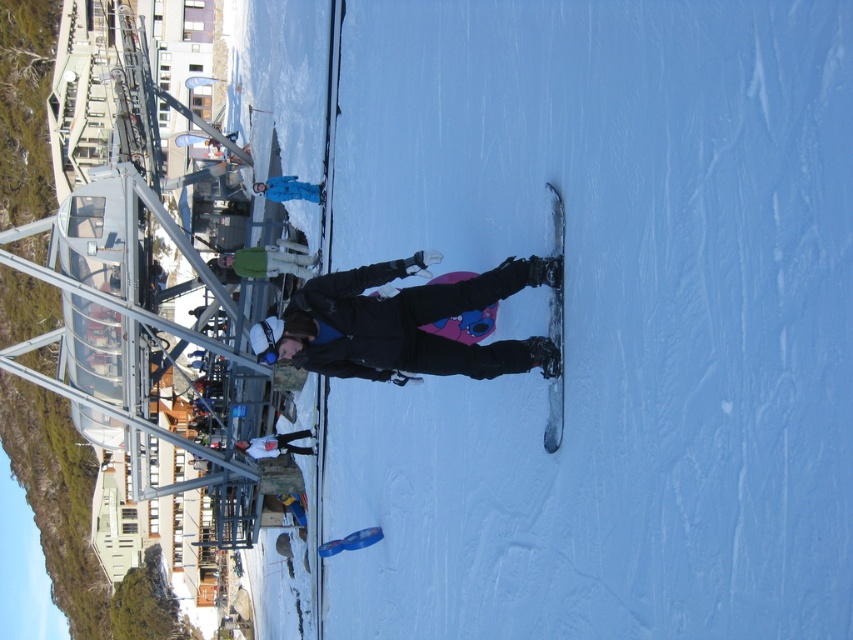
Question: Is metallic gray snowboard at center smaller than blue snowsuit at center?

Choices:
 (A) no
 (B) yes

Answer: (B)

Question: Among these points, which one is farthest from the camera?

Choices:
 (A) (360, 362)
 (B) (256, 250)
 (C) (305, 182)

Answer: (B)

Question: Can you confirm if metallic gray snowboard at center is smaller than blue snowsuit at center?

Choices:
 (A) no
 (B) yes

Answer: (B)

Question: Is metallic gray snowboard at center positioned in front of blue snowsuit at center?

Choices:
 (A) yes
 (B) no

Answer: (A)

Question: Which object is the farthest from the blue snowsuit at center?

Choices:
 (A) metallic gray snowboard at center
 (B) matte black snowboard at center
 (C) green fabric jacket at center

Answer: (A)

Question: Among these objects, which one is nearest to the camera?

Choices:
 (A) blue snowsuit at center
 (B) metallic gray snowboard at center

Answer: (B)